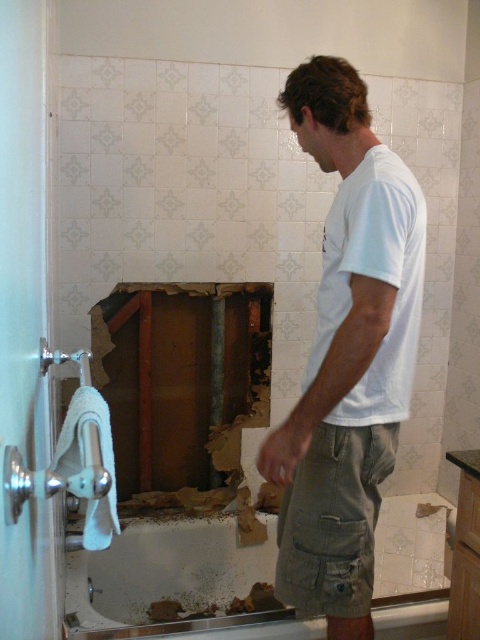
Question: Which of the following is the farthest from the observer?

Choices:
 (A) (367, 468)
 (B) (396, 371)

Answer: (A)

Question: Which object is closer to the camera taking this photo?

Choices:
 (A) khaki cotton shorts at center
 (B) white cotton t-shirt at center

Answer: (B)

Question: Which point is farther to the camera?

Choices:
 (A) khaki cotton shorts at center
 (B) white cotton t-shirt at center

Answer: (A)

Question: From the image, what is the correct spatial relationship of white cotton t-shirt at center in relation to khaki cotton shorts at center?

Choices:
 (A) above
 (B) below

Answer: (A)

Question: Does white cotton t-shirt at center appear over khaki cotton shorts at center?

Choices:
 (A) no
 (B) yes

Answer: (B)

Question: Observing the image, what is the correct spatial positioning of white cotton t-shirt at center in reference to khaki cotton shorts at center?

Choices:
 (A) right
 (B) left

Answer: (B)